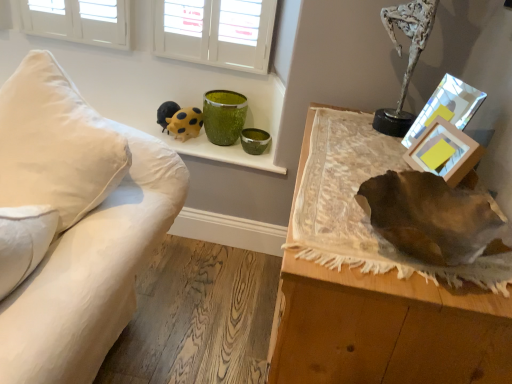
Question: Is green speckled glass vase at upper center with yellow dotted plush at upper center?

Choices:
 (A) no
 (B) yes

Answer: (A)

Question: Can you confirm if green speckled glass vase at upper center is thinner than yellow dotted plush at upper center?

Choices:
 (A) yes
 (B) no

Answer: (B)

Question: From a real-world perspective, is green speckled glass vase at upper center positioned under yellow dotted plush at upper center based on gravity?

Choices:
 (A) yes
 (B) no

Answer: (B)

Question: Considering the relative sizes of green speckled glass vase at upper center and yellow dotted plush at upper center in the image provided, is green speckled glass vase at upper center shorter than yellow dotted plush at upper center?

Choices:
 (A) no
 (B) yes

Answer: (A)

Question: Can you confirm if green speckled glass vase at upper center is positioned to the right of yellow dotted plush at upper center?

Choices:
 (A) no
 (B) yes

Answer: (B)

Question: Is green speckled glass vase at upper center smaller than yellow dotted plush at upper center?

Choices:
 (A) no
 (B) yes

Answer: (A)

Question: Does leather at right turn towards yellow dotted plush at upper center?

Choices:
 (A) yes
 (B) no

Answer: (A)

Question: Does leather at right contain yellow dotted plush at upper center?

Choices:
 (A) no
 (B) yes

Answer: (A)

Question: Is leather at right shorter than yellow dotted plush at upper center?

Choices:
 (A) yes
 (B) no

Answer: (B)

Question: Considering the relative sizes of leather at right and yellow dotted plush at upper center in the image provided, is leather at right thinner than yellow dotted plush at upper center?

Choices:
 (A) no
 (B) yes

Answer: (A)

Question: Does leather at right appear on the right side of yellow dotted plush at upper center?

Choices:
 (A) no
 (B) yes

Answer: (B)

Question: From a real-world perspective, is leather at right positioned under yellow dotted plush at upper center based on gravity?

Choices:
 (A) no
 (B) yes

Answer: (B)

Question: Can you confirm if yellow dotted plush at upper center is thinner than white fabric couch at left?

Choices:
 (A) yes
 (B) no

Answer: (A)